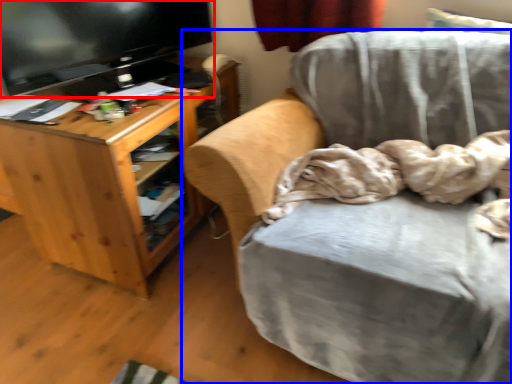
Question: Which of the following is the closest to the observer, television (highlighted by a red box) or chair (highlighted by a blue box)?

Choices:
 (A) television
 (B) chair

Answer: (B)